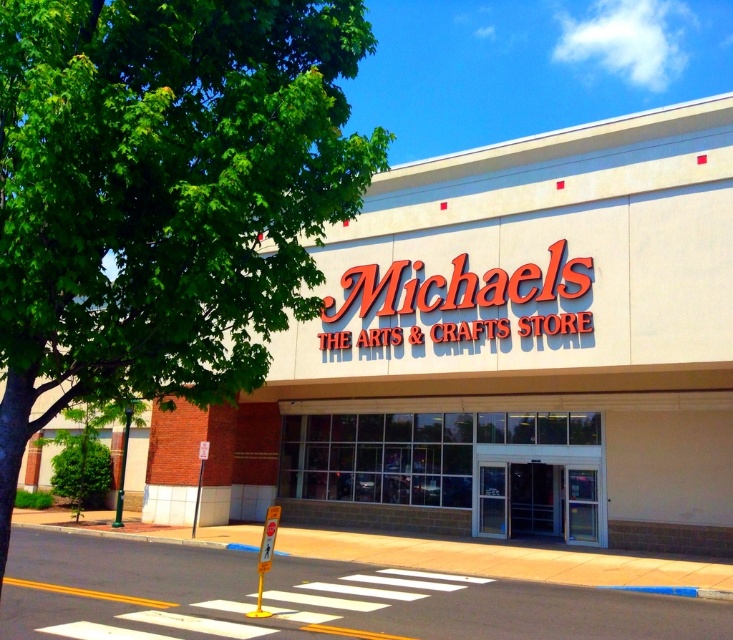
You are standing on the sidewalk in front of the Michaels store. You notice the white smooth building at center and the green leafy tree at upper left. Which object takes up more space in the image?

The white smooth building at center takes up more space in the image because it is bigger than the green leafy tree at upper left.

You are standing on the sidewalk in front of the Michaels store and notice a green leafy tree at upper left and clear glass doors at center. Which object is shorter?

The green leafy tree at upper left is shorter than the clear glass doors at center.